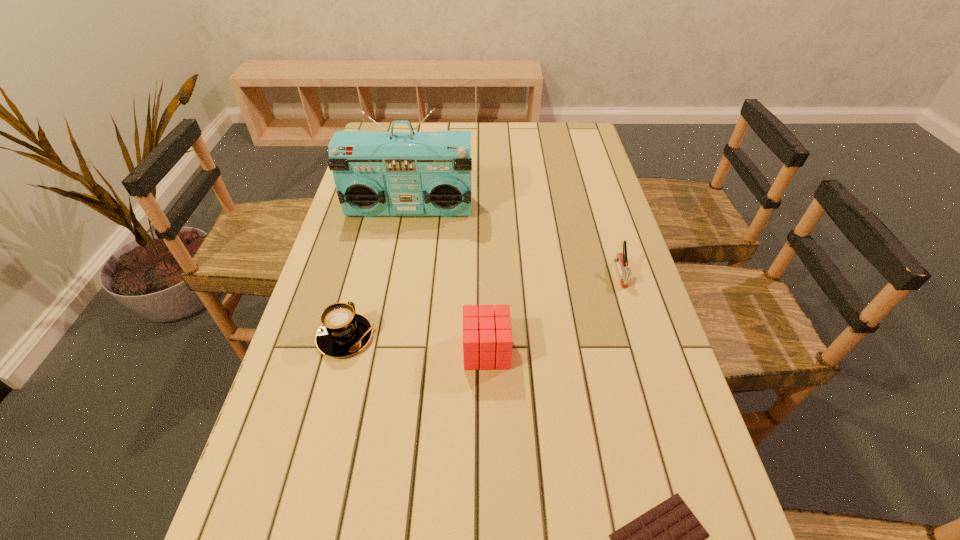
You are a GUI agent. You are given a task and a screenshot of the screen. Output one action in this format:
    pyautogui.click(x=<x>, y=<y>)
    Task: Click on the cappuccino present at the left edge
    Image resolution: width=960 pixels, height=540 pixels.
    Given the screenshot: What is the action you would take?
    pyautogui.click(x=343, y=332)

Image resolution: width=960 pixels, height=540 pixels. Identify the location of object located in the right edge section of the desktop. pyautogui.click(x=621, y=260).

In order to click on vacant region at the far edge of the desktop in this screenshot , I will do `click(448, 127)`.

This screenshot has width=960, height=540. In the image, there is a desktop. What are the coordinates of `vacant space at the left edge` in the screenshot? It's located at (252, 534).

This screenshot has width=960, height=540. What are the coordinates of `vacant region at the right edge of the desktop` in the screenshot? It's located at (569, 210).

Identify the location of free region at the far right corner. The width and height of the screenshot is (960, 540). (553, 122).

Find the location of a particular element. The image size is (960, 540). free space that is in between the cube and the cappuccino is located at coordinates (416, 344).

Where is `empty space that is in between the cube and the cappuccino`? Image resolution: width=960 pixels, height=540 pixels. empty space that is in between the cube and the cappuccino is located at coordinates (416, 344).

Where is `free area in between the radio receiver and the cappuccino`? Image resolution: width=960 pixels, height=540 pixels. free area in between the radio receiver and the cappuccino is located at coordinates (378, 273).

Identify the location of vacant point located between the cappuccino and the cube. (416, 344).